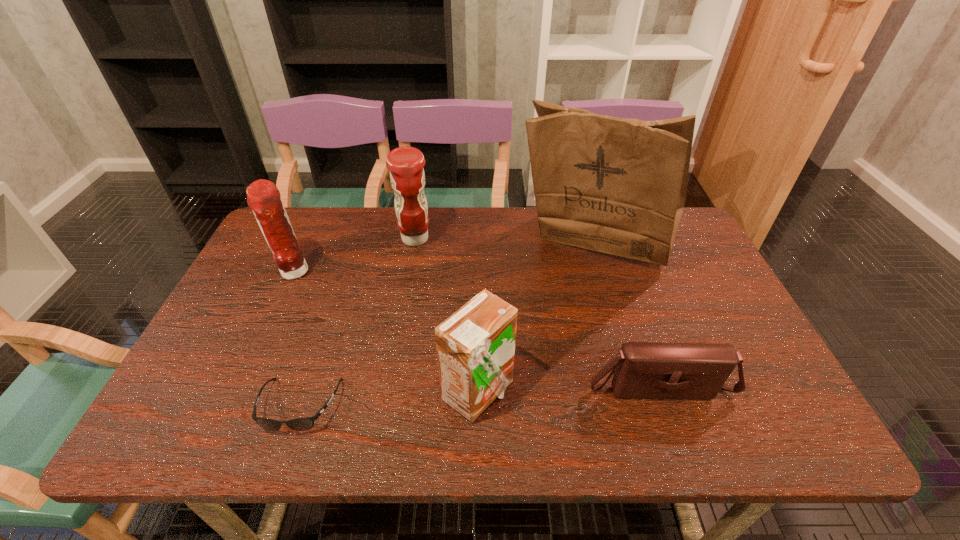
The image size is (960, 540). What are the coordinates of `grocery bag that is at the right edge` in the screenshot? It's located at (618, 186).

Locate an element on the screen. This screenshot has width=960, height=540. shoulder bag present at the right edge is located at coordinates (644, 370).

Where is `object situated at the far right corner`? This screenshot has height=540, width=960. object situated at the far right corner is located at coordinates (618, 186).

In the image, there is a desktop. At what (x,y) coordinates should I click in order to perform the action: click on vacant space at the far edge. Please return your answer as a coordinate pair (x, y). This screenshot has width=960, height=540. Looking at the image, I should click on (562, 249).

Where is `free space at the near edge of the desktop`? free space at the near edge of the desktop is located at coordinates (x=482, y=426).

Find the location of a particular element. free space at the right edge of the desktop is located at coordinates (688, 258).

This screenshot has width=960, height=540. I want to click on free spot at the far left corner of the desktop, so click(x=315, y=214).

This screenshot has height=540, width=960. What are the coordinates of `vacant space at the far right corner of the desktop` in the screenshot? It's located at (682, 233).

What are the coordinates of `empty space between the farther condiment and the third shortest object` in the screenshot? It's located at (446, 316).

The image size is (960, 540). I want to click on vacant space that is in between the grocery bag and the left condiment, so click(x=444, y=260).